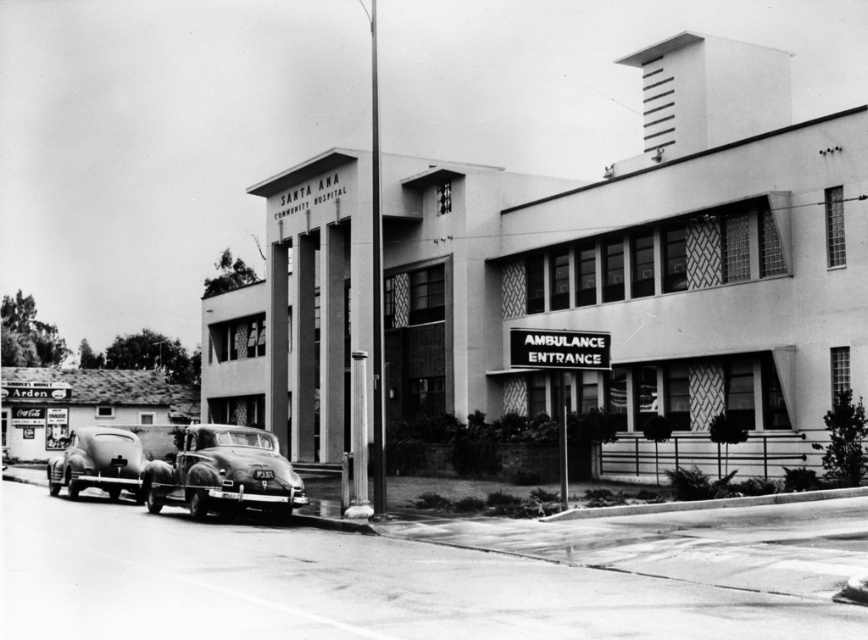
You are standing at the entrance of Santa Ana Community Hospital and want to park your car. The hospital requires that all vehicles must be parked within a 10 meter radius of the ambulance entrance. Given that the shiny silver car at center is located at coordinates point 0.739, 0.258, can you determine if this car is within the required parking zone?

The shiny silver car at center is located at coordinates point (x=222, y=472). Since the hospital requires vehicles to be parked within a 10 meter radius of the ambulance entrance, the exact distance from the ambulance entrance to the car must be calculated. However, without knowing the scale of the coordinate system or the actual distance corresponding to the coordinate values, it is impossible to determine if the car is within the required 10 meter radius. Additional information about the coordinate system,

You are a delivery driver who needs to park your truck, which is 2 meters wide, in the parking lot near the shiny silver car at center and shiny chrome car at lower left. Can your truck fit between these two cars if there is enough space?

The shiny silver car at center is narrower than the shiny chrome car at lower left. However, without knowing the exact distance between them, it is impossible to determine if there is enough space for a 2 meter wide truck. More information about the spacing between the two cars is required to answer this question accurately.